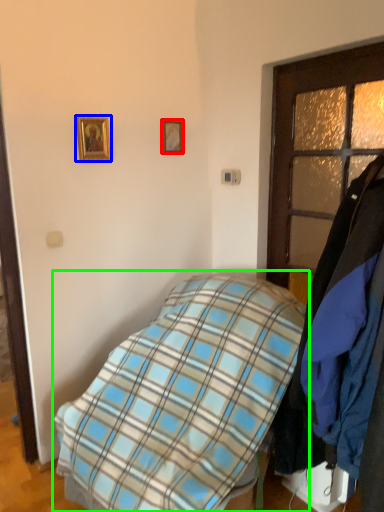
Question: Estimate the real-world distances between objects in this image. Which object is closer to picture frame (highlighted by a red box), picture frame (highlighted by a blue box) or bed (highlighted by a green box)?

Choices:
 (A) picture frame
 (B) bed

Answer: (A)